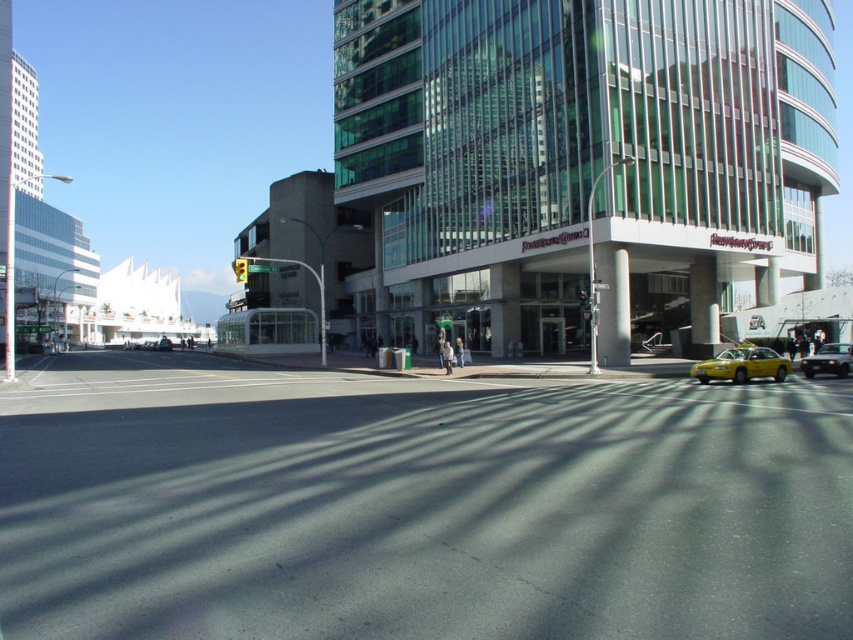
Question: Which point is closer to the camera taking this photo?

Choices:
 (A) (769, 365)
 (B) (235, 259)
 (C) (805, 369)
 (D) (833, 628)

Answer: (D)

Question: Which point is closer to the camera?

Choices:
 (A) (335, 483)
 (B) (239, 275)
 (C) (775, 364)
 (D) (834, 371)

Answer: (A)

Question: Does yellow rubber at center have a larger size compared to yellow matte taxi at lower right?

Choices:
 (A) no
 (B) yes

Answer: (B)

Question: Where is yellow matte taxi at lower right located in relation to metallic silver sedan at right in the image?

Choices:
 (A) below
 (B) above

Answer: (B)

Question: Is yellow rubber at center above green glass traffic light at upper center?

Choices:
 (A) no
 (B) yes

Answer: (A)

Question: Estimate the real-world distances between objects in this image. Which object is closer to the green glass traffic light at upper center?

Choices:
 (A) yellow matte taxi at lower right
 (B) yellow rubber at center
 (C) metallic silver sedan at right

Answer: (B)